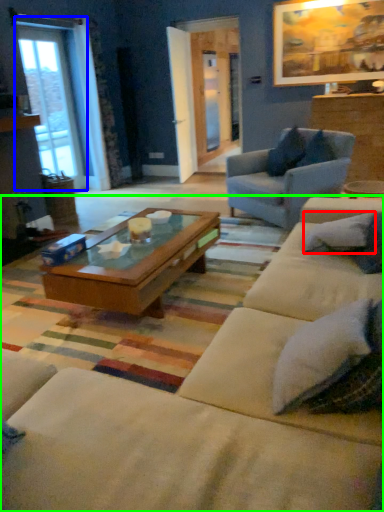
Question: Which object is positioned closest to pillow (highlighted by a red box)? Select from window (highlighted by a blue box) and studio couch (highlighted by a green box).

Choices:
 (A) window
 (B) studio couch

Answer: (B)